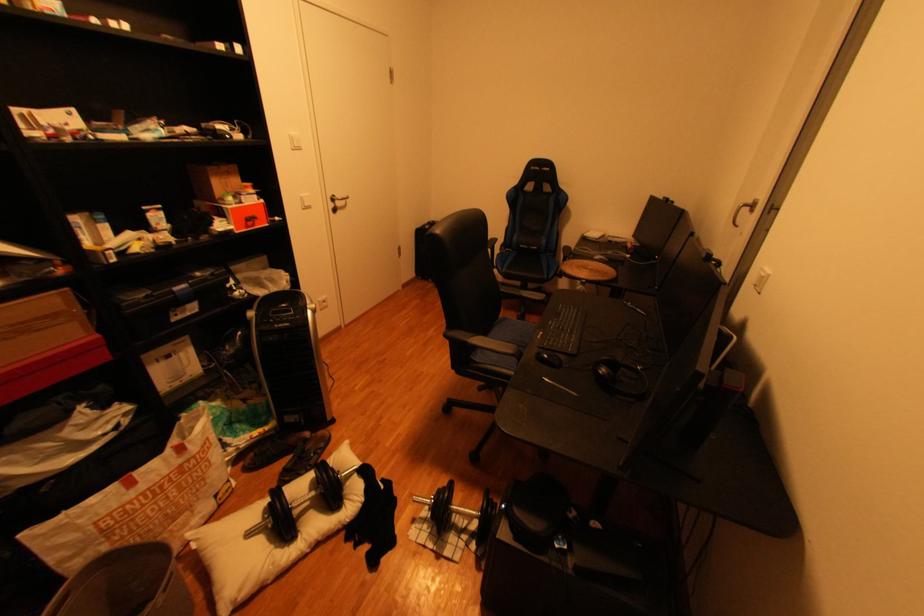
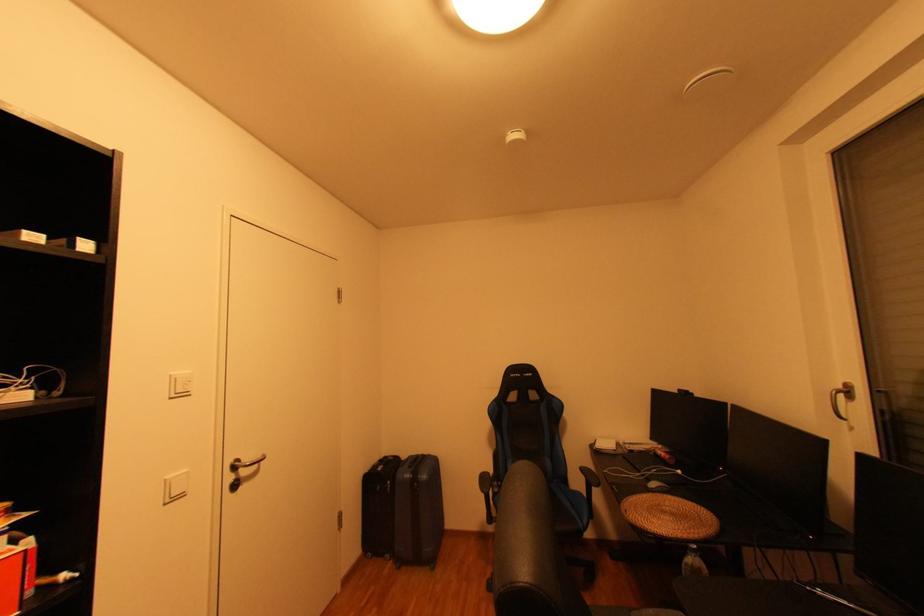
In the second image, find the point that corresponds to [760,203] in the first image.

(849, 387)